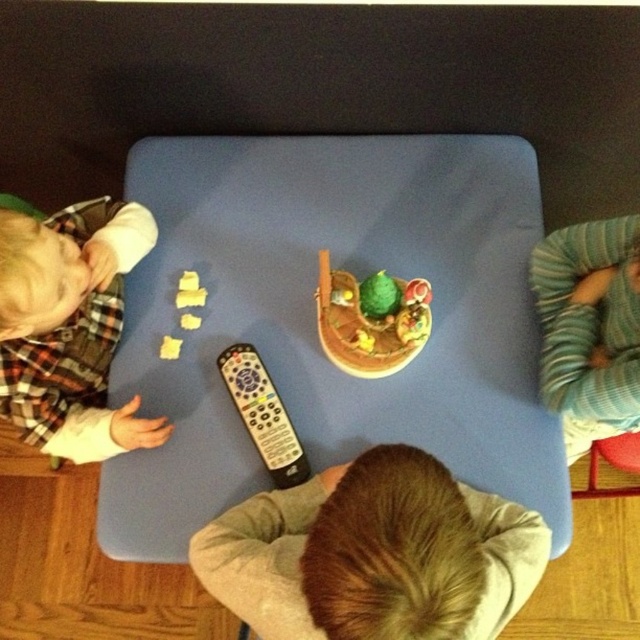
From the picture: Can you confirm if blue fabric table at center is positioned to the left of flannel shirt at left?

Incorrect, blue fabric table at center is not on the left side of flannel shirt at left.

You are a GUI agent. You are given a task and a screenshot of the screen. Output one action in this format:
    pyautogui.click(x=<x>, y=<y>)
    Task: Click on the blue fabric table at center
    The image size is (640, 640).
    Given the screenshot: What is the action you would take?
    pyautogui.click(x=314, y=320)

Which of these two, blonde hair at center or flannel shirt at left, stands shorter?

blonde hair at center

This screenshot has width=640, height=640. Describe the element at coordinates (374, 554) in the screenshot. I see `blonde hair at center` at that location.

Image resolution: width=640 pixels, height=640 pixels. Find the location of `blonde hair at center`. blonde hair at center is located at coordinates (374, 554).

What are the coordinates of `blonde hair at center` in the screenshot? It's located at (374, 554).

Based on the photo, is blonde hair at center positioned behind green striped sweater at right?

No, blonde hair at center is in front of green striped sweater at right.

Does blonde hair at center have a greater width compared to green striped sweater at right?

Yes, blonde hair at center is wider than green striped sweater at right.

Image resolution: width=640 pixels, height=640 pixels. What do you see at coordinates (374, 554) in the screenshot? I see `blonde hair at center` at bounding box center [374, 554].

Where is `blonde hair at center`? The width and height of the screenshot is (640, 640). blonde hair at center is located at coordinates (374, 554).